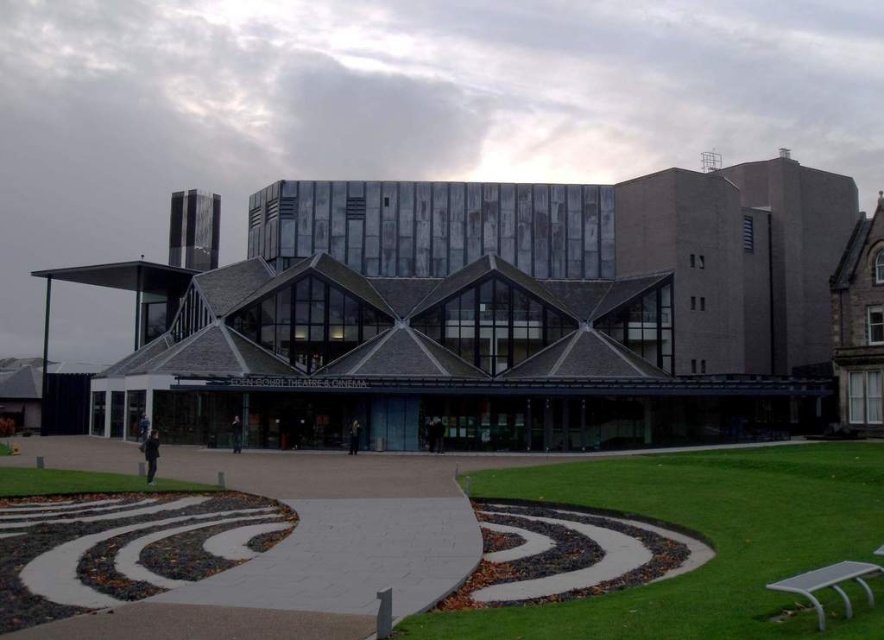
Between dark gray concrete building at center and green grass at lower left, which one has more height?

Standing taller between the two is dark gray concrete building at center.

Does dark gray concrete building at center come behind green grass at lower left?

That is True.

Where is `dark gray concrete building at center`? dark gray concrete building at center is located at coordinates (494, 314).

Where is `dark gray concrete building at center`? The width and height of the screenshot is (884, 640). dark gray concrete building at center is located at coordinates (494, 314).

Between point (875, 481) and point (31, 493), which one is positioned behind?

Point (875, 481)

From the picture: Is green grass at center to the left of green grass at lower left from the viewer's perspective?

No, green grass at center is not to the left of green grass at lower left.

Identify the location of green grass at center. (707, 536).

Which is below, dark gray concrete building at center or green grass at center?

green grass at center

Describe the element at coordinates (494, 314) in the screenshot. I see `dark gray concrete building at center` at that location.

Which is in front, point (299, 365) or point (859, 632)?

Point (859, 632)

Image resolution: width=884 pixels, height=640 pixels. I want to click on dark gray concrete building at center, so click(x=494, y=314).